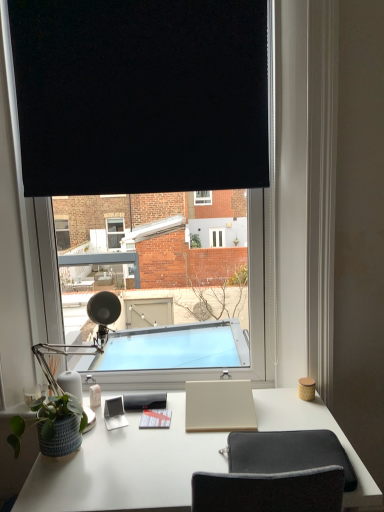
Question: Is black matte window at center located within beige matte notepad at center, marked as the 3th notepad in a left-to-right arrangement?

Choices:
 (A) no
 (B) yes

Answer: (A)

Question: Is beige matte notepad at center, the first notepad viewed from the right, outside black matte window at center?

Choices:
 (A) yes
 (B) no

Answer: (A)

Question: Is beige matte notepad at center, the first notepad viewed from the right, facing away from black matte window at center?

Choices:
 (A) no
 (B) yes

Answer: (B)

Question: Considering the relative sizes of beige matte notepad at center, marked as the 3th notepad in a left-to-right arrangement, and black matte window at center in the image provided, is beige matte notepad at center, marked as the 3th notepad in a left-to-right arrangement, taller than black matte window at center?

Choices:
 (A) yes
 (B) no

Answer: (B)

Question: Does beige matte notepad at center, marked as the 3th notepad in a left-to-right arrangement, have a larger size compared to black matte window at center?

Choices:
 (A) yes
 (B) no

Answer: (B)

Question: From a real-world perspective, is matte gray notepad at center, placed as the 1th notepad when sorted from left to right, physically located above or below black fabric at upper center?

Choices:
 (A) above
 (B) below

Answer: (B)

Question: Is point (152, 398) positioned closer to the camera than point (140, 58)?

Choices:
 (A) farther
 (B) closer

Answer: (A)

Question: Is matte gray notepad at center, placed as the 1th notepad when sorted from left to right, in front of or behind black fabric at upper center in the image?

Choices:
 (A) front
 (B) behind

Answer: (B)

Question: Considering the positions of matte gray notepad at center, placed as the 1th notepad when sorted from left to right, and black fabric at upper center in the image, is matte gray notepad at center, placed as the 1th notepad when sorted from left to right, wider or thinner than black fabric at upper center?

Choices:
 (A) thin
 (B) wide

Answer: (B)

Question: Is white paper notepad at center, the second notepad in the right-to-left sequence, wider or thinner than beige matte notepad at center, the first notepad viewed from the right?

Choices:
 (A) wide
 (B) thin

Answer: (B)

Question: Based on their positions, is white paper notepad at center, the second notepad in the right-to-left sequence, located to the left or right of beige matte notepad at center, marked as the 3th notepad in a left-to-right arrangement?

Choices:
 (A) left
 (B) right

Answer: (A)

Question: Is white paper notepad at center, the second notepad in the right-to-left sequence, bigger or smaller than beige matte notepad at center, marked as the 3th notepad in a left-to-right arrangement?

Choices:
 (A) small
 (B) big

Answer: (A)

Question: Considering the positions of white paper notepad at center, the second notepad in the right-to-left sequence, and beige matte notepad at center, marked as the 3th notepad in a left-to-right arrangement, in the image, is white paper notepad at center, the second notepad in the right-to-left sequence, taller or shorter than beige matte notepad at center, marked as the 3th notepad in a left-to-right arrangement,?

Choices:
 (A) short
 (B) tall

Answer: (A)

Question: In terms of width, does matte black table lamp at left look wider or thinner when compared to green matte plant pot at lower left?

Choices:
 (A) wide
 (B) thin

Answer: (A)

Question: In terms of size, does matte black table lamp at left appear bigger or smaller than green matte plant pot at lower left?

Choices:
 (A) small
 (B) big

Answer: (B)